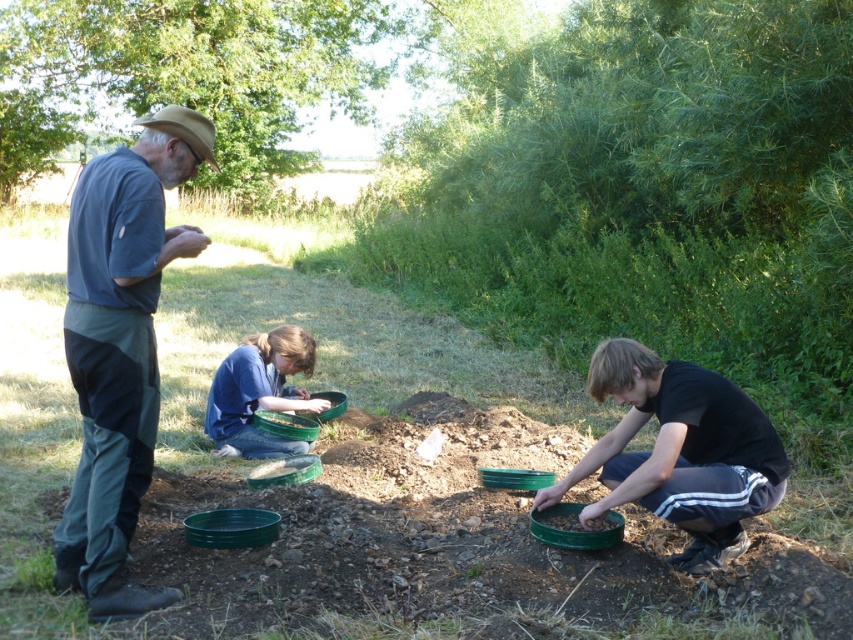
Question: Is blue fabric shirt at left positioned in front of black matte bowl at lower right?

Choices:
 (A) yes
 (B) no

Answer: (A)

Question: Which point appears closest to the camera in this image?

Choices:
 (A) (727, 534)
 (B) (103, 595)

Answer: (B)

Question: Which of the following is the closest to the observer?

Choices:
 (A) blue fabric shirt at left
 (B) black matte bowl at lower right

Answer: (A)

Question: Does blue fabric shirt at left appear under black matte bowl at lower right?

Choices:
 (A) no
 (B) yes

Answer: (A)

Question: Which of the following is the closest to the observer?

Choices:
 (A) blue fabric shirt at center
 (B) black matte bowl at lower right
 (C) blue fabric shirt at left

Answer: (C)

Question: Does blue fabric shirt at left appear on the right side of black matte bowl at lower right?

Choices:
 (A) yes
 (B) no

Answer: (B)